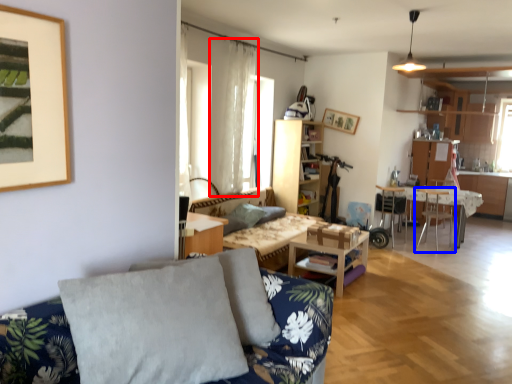
Question: Which of the following is the farthest to the observer, curtain (highlighted by a red box) or chair (highlighted by a blue box)?

Choices:
 (A) curtain
 (B) chair

Answer: (B)